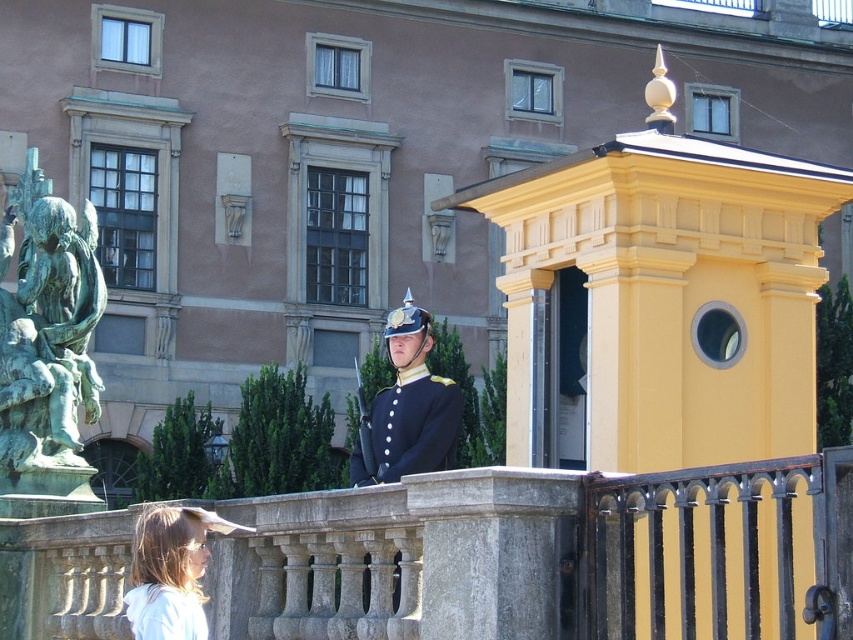
Question: Does light brown hair at lower left have a larger size compared to navy blue fabric uniform at center?

Choices:
 (A) yes
 (B) no

Answer: (B)

Question: Does stone balustrade at center have a greater width compared to navy blue fabric uniform at center?

Choices:
 (A) yes
 (B) no

Answer: (A)

Question: Which point appears closest to the camera in this image?

Choices:
 (A) (71, 320)
 (B) (358, 458)

Answer: (B)

Question: Is green patina statue at left to the left of light brown hair at lower left from the viewer's perspective?

Choices:
 (A) no
 (B) yes

Answer: (B)

Question: Which point appears closest to the camera in this image?

Choices:
 (A) click(x=355, y=460)
 (B) click(x=141, y=538)
 (C) click(x=138, y=589)
 (D) click(x=416, y=468)

Answer: (C)

Question: Estimate the real-world distances between objects in this image. Which object is farther from the stone balustrade at center?

Choices:
 (A) navy blue fabric uniform at center
 (B) shiny black uniform at center

Answer: (A)